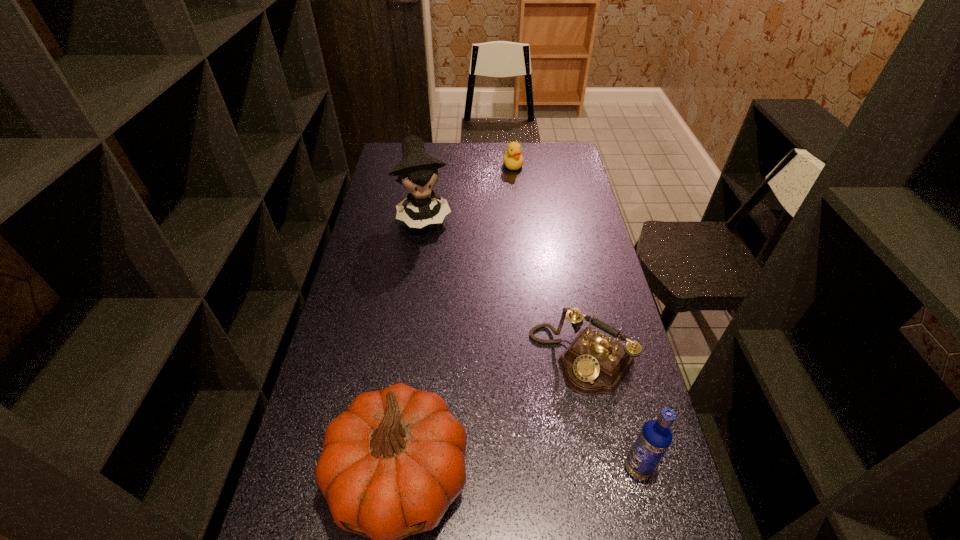
In order to click on vodka in this screenshot , I will do `click(655, 437)`.

Image resolution: width=960 pixels, height=540 pixels. Identify the location of the fourth nearest object. (417, 171).

The width and height of the screenshot is (960, 540). Identify the location of doll. (417, 171).

At what (x,y) coordinates should I click in order to perform the action: click on telephone. Please return your answer as a coordinate pair (x, y). Looking at the image, I should click on (593, 364).

At what (x,y) coordinates should I click in order to perform the action: click on the third nearest object. Please return your answer as a coordinate pair (x, y). Looking at the image, I should click on (593, 364).

Where is `the farthest object`? The width and height of the screenshot is (960, 540). the farthest object is located at coordinates (513, 159).

Locate an element on the screen. the shortest object is located at coordinates (513, 159).

The width and height of the screenshot is (960, 540). I want to click on vacant space located on the left of the vodka, so click(578, 468).

Identify the location of free space located 0.220m at the face of the second farthest object. The height and width of the screenshot is (540, 960). click(x=444, y=276).

The image size is (960, 540). In order to click on vacant area situated at the face of the second farthest object in this screenshot , I will do `click(435, 251)`.